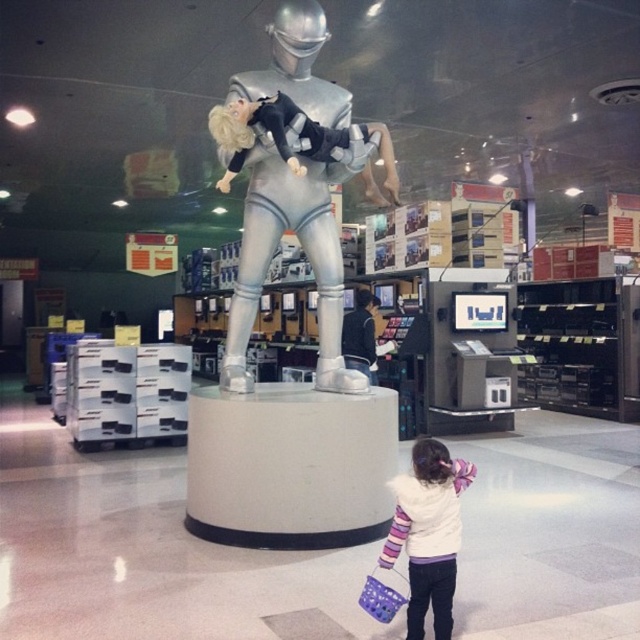
You are a delivery person who needs to place a large box in the store. The box is 1.2 meters wide. You see the silver metallic statue at center and the plastic purple shopping basket at lower right. Can the box fit between them?

The silver metallic statue at center might be wider than plastic purple shopping basket at lower right, so the box may not fit between them. Check the exact width before placing the box.